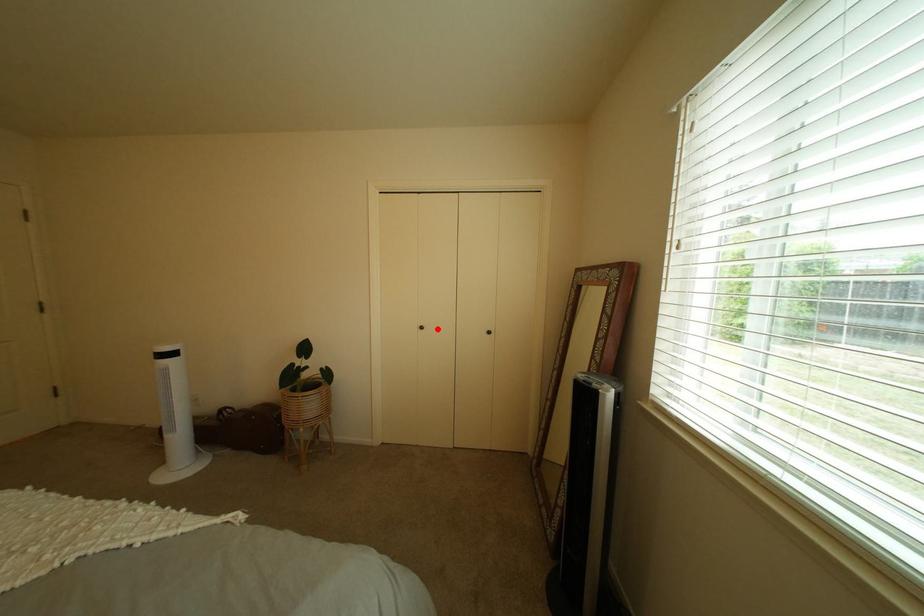
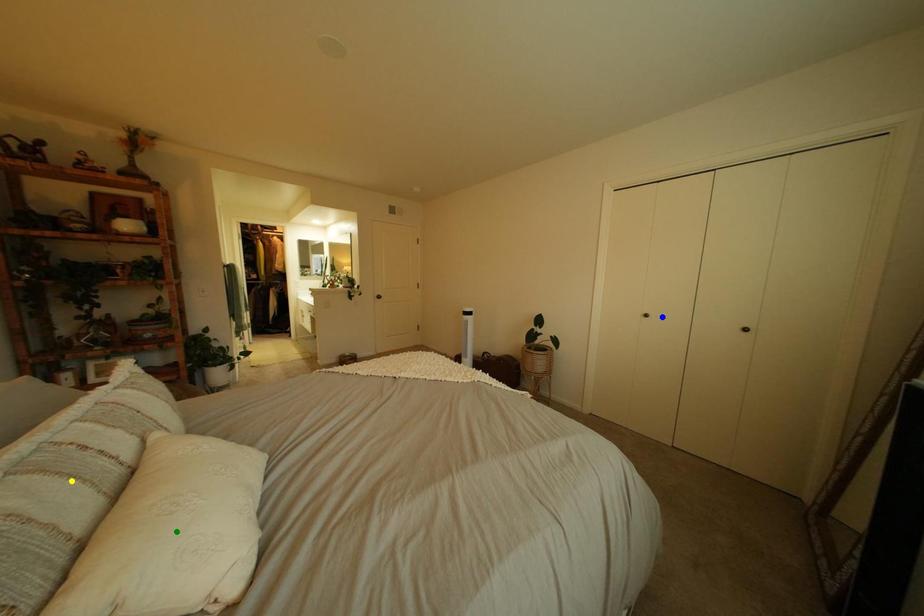
Question: I am providing you with two images of the same scene from different viewpoints. A red point is marked on the first image. You are given multiple points on the second image. Which point in image 2 represents the same 3d spot as the red point in image 1?

Choices:
 (A) blue point
 (B) yellow point
 (C) green point

Answer: (A)